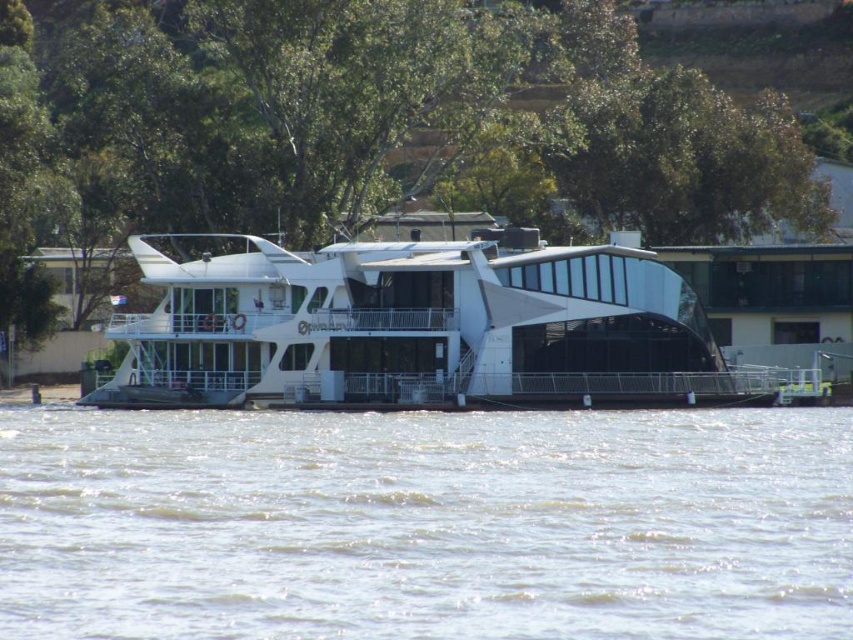
You are standing on the dock and looking at the clear water at lower center and the white glossy boat at center. Which object is taller from your perspective?

The white glossy boat at center is taller than the clear water at lower center.

You are a photographer planning to capture the white glossy boat at center and the clear water at lower center in a single shot. Based on their sizes in the image, which object would appear larger in your photo?

The white glossy boat at center appears larger than the clear water at lower center in the image, so it would be the larger object in the photo.